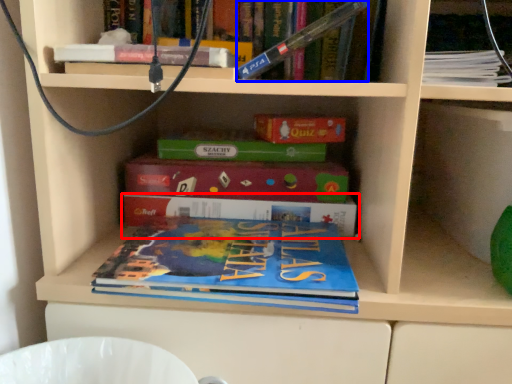
Question: Which object is further to the camera taking this photo, book (highlighted by a red box) or book (highlighted by a blue box)?

Choices:
 (A) book
 (B) book

Answer: (A)